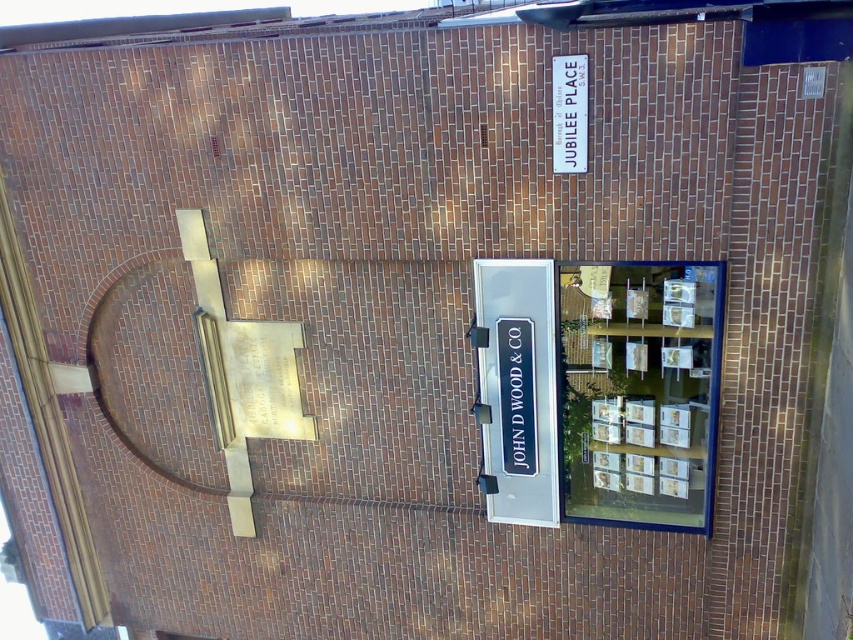
Question: Does black plastic sign at center appear on the right side of white plastic sign at upper center?

Choices:
 (A) no
 (B) yes

Answer: (A)

Question: Which point is closer to the camera?

Choices:
 (A) black plastic sign at center
 (B) white plastic sign at upper center

Answer: (B)

Question: Can you confirm if black plastic sign at center is positioned below white plastic sign at upper center?

Choices:
 (A) no
 (B) yes

Answer: (B)

Question: Which point appears farthest from the camera in this image?

Choices:
 (A) (575, 76)
 (B) (519, 323)

Answer: (B)

Question: Is black plastic sign at center to the right of white plastic sign at upper center from the viewer's perspective?

Choices:
 (A) yes
 (B) no

Answer: (B)